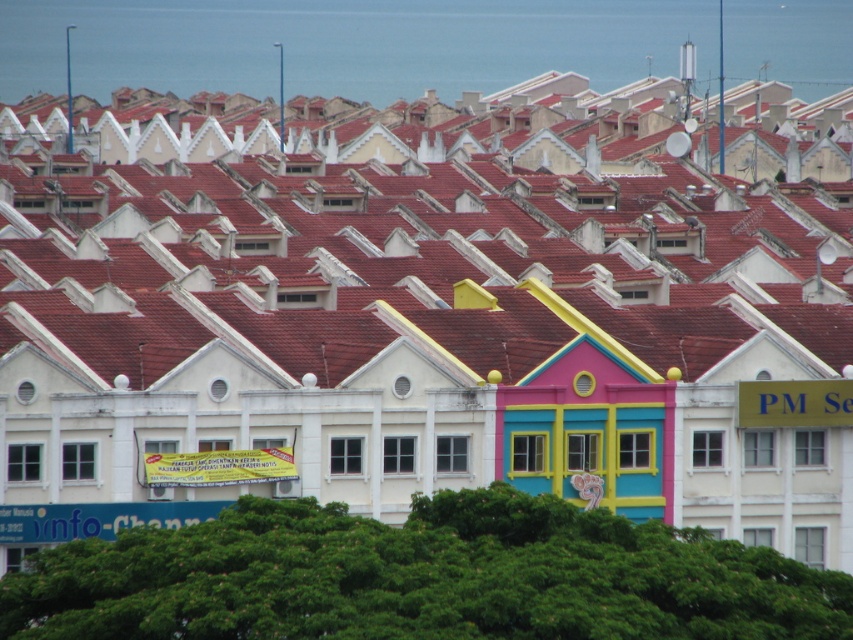
Looking at this image, you are standing at the point with coordinates point (838, 275) and want to walk to the point (566, 392). Given that you can only move forward in a straight line, will you be able to reach the destination without any obstacles?

Point (838, 275) is behind point (566, 392), so if you are at point (838, 275) and move forward in a straight line, you will first encounter point (566, 392) in your path. Therefore, you can reach the destination without any obstacles.

You are a delivery person trying to deliver a package to the multicolored painted house at center. However, you notice the red clay tiles at center blocking the path. Can you still reach the house?

The red clay tiles at center are in front of the multicolored painted house at center, so they are blocking the path. You cannot reach the house directly through that route.